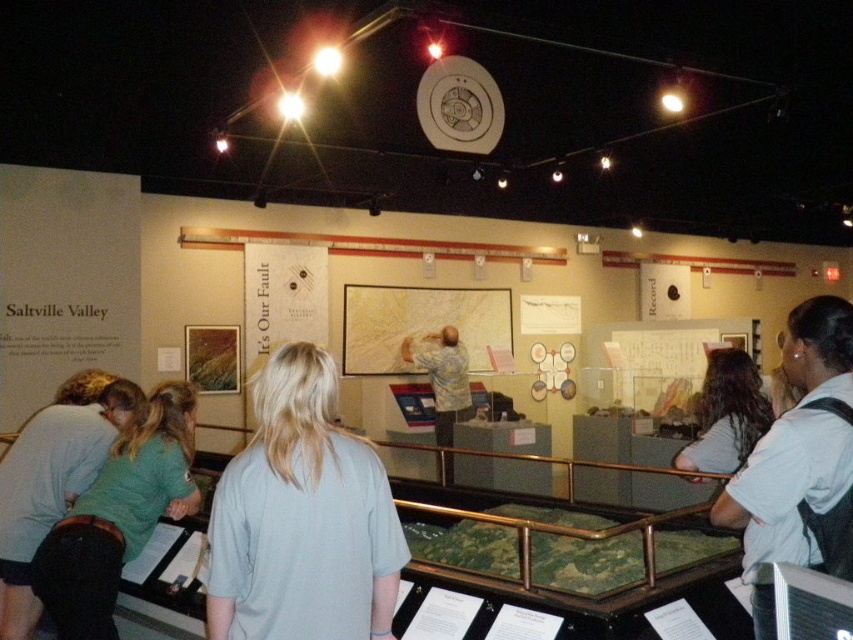
Looking at this image, you are a visitor in the museum exhibit and want to get a clear view of the Saltville Valley panel. There are two people in front of you wearing light gray shirt at center and light blue shirt at center. Which person is closer to you?

The light gray shirt at center is closer to you because the light blue shirt at center is behind it.

Based on the photo, you are a tour guide in the museum and need to ensure that both the light gray shirt at center and the light blue shirt at center can fit through the narrow doorway. The doorway is 1.5 meters wide. Can both individuals pass through the doorway side by side?

The light gray shirt at center has a lesser width compared to light blue shirt at center. Since the total width of both shirts combined is less than 1.5 meters, they can pass through the doorway side by side.